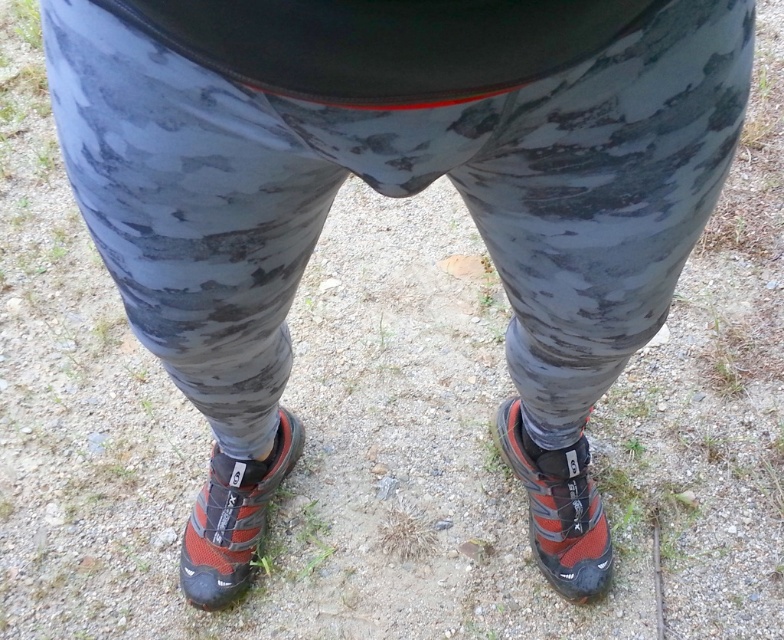
Between red mesh shoe at lower right and matte orange shoe at lower center, which one has more height?

red mesh shoe at lower right

Does point (565, 515) come in front of point (187, 536)?

Yes, point (565, 515) is in front of point (187, 536).

Locate an element on the screen. The width and height of the screenshot is (784, 640). red mesh shoe at lower right is located at coordinates (559, 508).

Based on the photo, which is above, red mesh shoe at lower right or black mesh sock at lower center?

black mesh sock at lower center

Is point (581, 508) closer to camera compared to point (241, 451)?

That is False.

Locate an element on the screen. The width and height of the screenshot is (784, 640). red mesh shoe at lower right is located at coordinates coord(559,508).

Who is positioned more to the right, matte orange shoe at lower center or black mesh sock at lower center?

Positioned to the right is black mesh sock at lower center.

Image resolution: width=784 pixels, height=640 pixels. Describe the element at coordinates (233, 516) in the screenshot. I see `matte orange shoe at lower center` at that location.

You are a GUI agent. You are given a task and a screenshot of the screen. Output one action in this format:
    pyautogui.click(x=<x>, y=<y>)
    Task: Click on the matte orange shoe at lower center
    This screenshot has height=640, width=784.
    Given the screenshot: What is the action you would take?
    pyautogui.click(x=233, y=516)